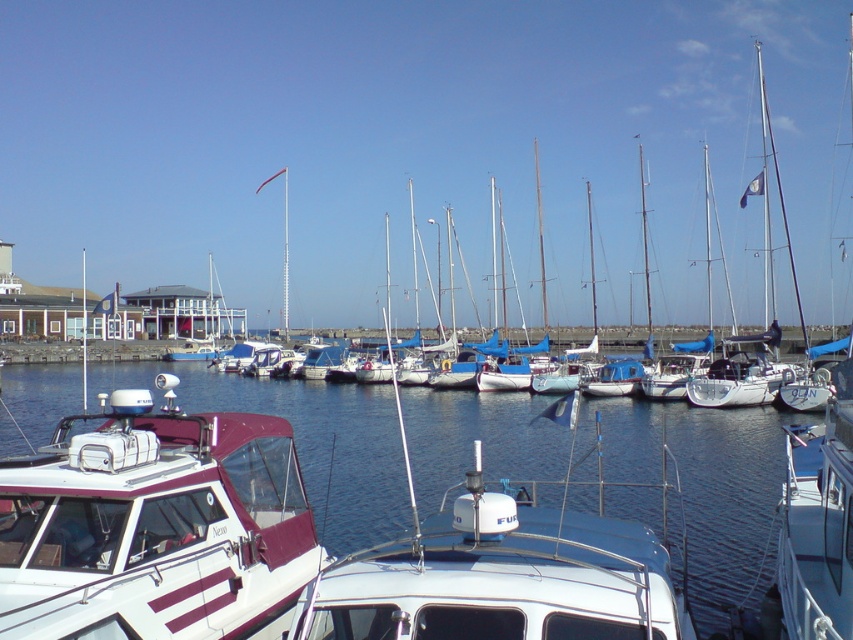
Which is more to the left, clear water at center or maroon matte boat at lower left?

Positioned to the left is clear water at center.

Between point (657, 522) and point (209, 464), which one is positioned behind?

The point (657, 522) is behind.

Find the location of a particular element. The image size is (853, 640). clear water at center is located at coordinates (695, 486).

Is maroon matte boat at lower left closer to the viewer compared to white glossy boat at center?

That is False.

Does point (192, 499) come closer to viewer compared to point (438, 625)?

That is False.

You are a GUI agent. You are given a task and a screenshot of the screen. Output one action in this format:
    pyautogui.click(x=<x>, y=<y>)
    Task: Click on the maroon matte boat at lower left
    The image size is (853, 640).
    Given the screenshot: What is the action you would take?
    pyautogui.click(x=155, y=525)

Is clear water at center bigger than white glossy boat at center?

Indeed, clear water at center has a larger size compared to white glossy boat at center.

What do you see at coordinates (695, 486) in the screenshot? I see `clear water at center` at bounding box center [695, 486].

At what (x,y) coordinates should I click in order to perform the action: click on clear water at center. Please return your answer as a coordinate pair (x, y). This screenshot has height=640, width=853. Looking at the image, I should click on (695, 486).